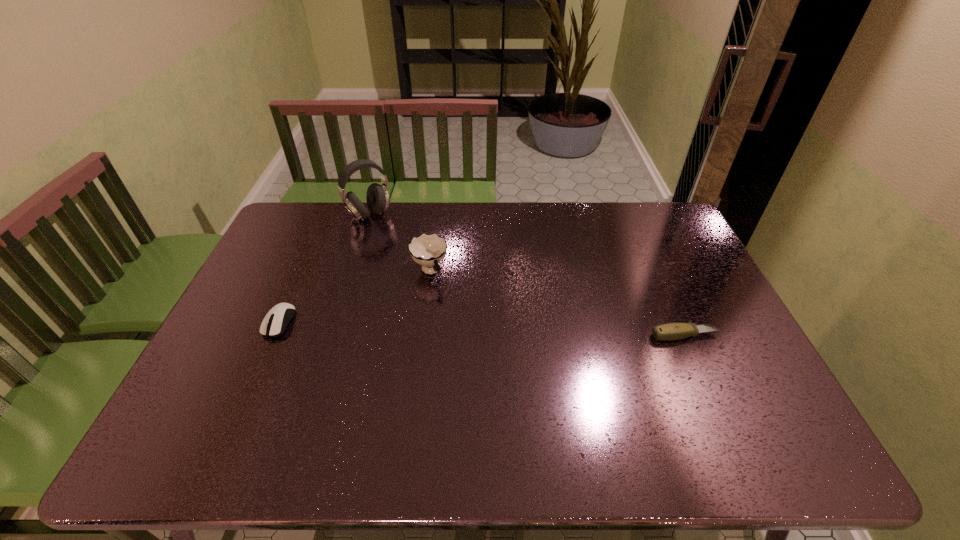
Where is `vacant spot on the desktop that is between the third tallest object and the rightmost object and is positioned on the ear cups of the tallest object`? The height and width of the screenshot is (540, 960). vacant spot on the desktop that is between the third tallest object and the rightmost object and is positioned on the ear cups of the tallest object is located at coordinates (456, 328).

Locate an element on the screen. vacant spot on the desktop that is between the mouse and the shortest object and is positioned on the side of the second farthest object with the handle is located at coordinates (466, 328).